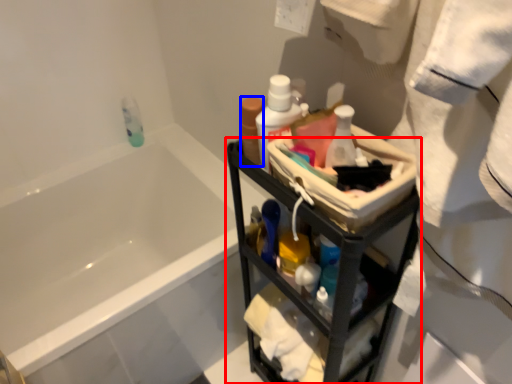
Question: Which object appears closest to the camera in this image, furniture (highlighted by a red box) or mouthwash (highlighted by a blue box)?

Choices:
 (A) furniture
 (B) mouthwash

Answer: (A)